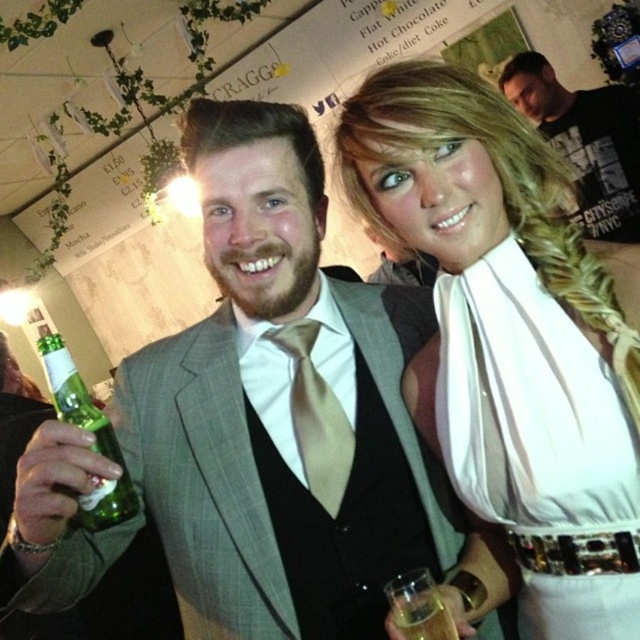
Question: Does white satin dress at center appear on the right side of satin beige tie at center?

Choices:
 (A) yes
 (B) no

Answer: (A)

Question: Does black cotton t-shirt at upper right appear under translucent glass at lower center?

Choices:
 (A) yes
 (B) no

Answer: (B)

Question: Which object appears farthest from the camera in this image?

Choices:
 (A) green glass bottle at left
 (B) satin beige tie at center
 (C) gray textured suit at center

Answer: (B)

Question: Is white satin dress at center to the left of white satin dress at upper right from the viewer's perspective?

Choices:
 (A) yes
 (B) no

Answer: (A)

Question: Among these points, which one is farthest from the camera?

Choices:
 (A) (460, 433)
 (B) (552, 138)
 (C) (292, 365)

Answer: (B)

Question: Which of the following is the farthest from the observer?

Choices:
 (A) (112, 490)
 (B) (563, 616)
 (C) (396, 596)

Answer: (B)